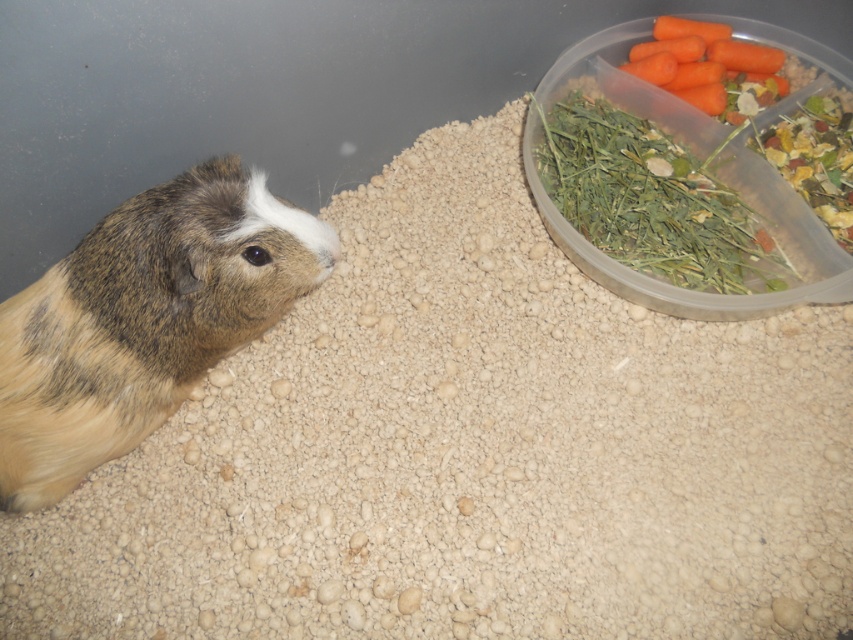
You are a small animal keeper who needs to ensure that the brown fur hamster at left can see its food. Based on the enclosure setup, will the orange matte carrot at upper right be visible to the hamster?

The brown fur hamster at left has a greater height compared to orange matte carrot at upper right, so the hamster can see over the carrot and likely has a clear line of sight to it.

You are a guinea pig in the enclosure. You see the brown fur hamster at left and the orange matte carrot at upper right. Which object is positioned higher in the image?

The orange matte carrot at upper right is positioned higher than the brown fur hamster at left.